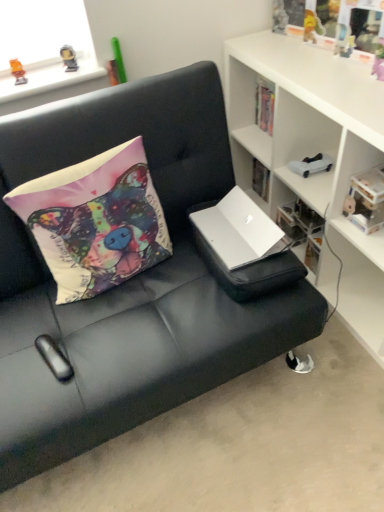
Question: Relative to clear plastic storage at center, is matte fabric pillow at upper left in front or behind?

Choices:
 (A) front
 (B) behind

Answer: (A)

Question: From their relative heights in the image, would you say matte fabric pillow at upper left is taller or shorter than clear plastic storage at center?

Choices:
 (A) tall
 (B) short

Answer: (A)

Question: Which of these objects is positioned closest to the matte fabric pillow at upper left?

Choices:
 (A) black leather couch at center
 (B) clear plastic storage at center
 (C) white matte cabinet at upper right
 (D) white plastic book at upper right
 (E) translucent plastic toy at upper left, the 1th toy from the left

Answer: (A)

Question: Based on their relative distances, which object is nearer to the white plastic toy car at upper right, the 1th toy in the right-to-left sequence?

Choices:
 (A) clear plastic storage at center
 (B) white matte laptop at center
 (C) translucent plastic toy at upper left, which is the 2th toy from top to bottom
 (D) black leather couch at center
 (E) matte fabric pillow at upper left

Answer: (A)